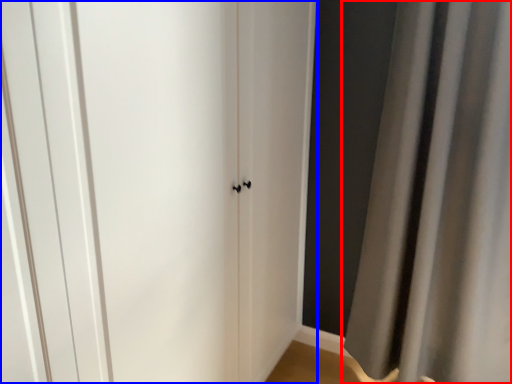
Question: Which object appears farthest to the camera in this image, curtain (highlighted by a red box) or door (highlighted by a blue box)?

Choices:
 (A) curtain
 (B) door

Answer: (A)